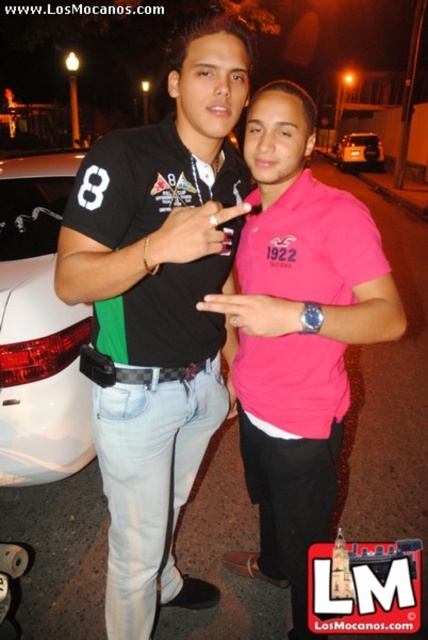
Question: Which object appears closest to the camera in this image?

Choices:
 (A) white glossy car at left
 (B) metallic silver car at center

Answer: (A)

Question: Which of the following is the closest to the observer?

Choices:
 (A) (366, 168)
 (B) (2, 483)

Answer: (B)

Question: Does white glossy car at left appear on the left side of metallic silver car at center?

Choices:
 (A) yes
 (B) no

Answer: (A)

Question: Is white glossy car at left smaller than metallic silver car at center?

Choices:
 (A) yes
 (B) no

Answer: (A)

Question: Observing the image, what is the correct spatial positioning of white glossy car at left in reference to metallic silver car at center?

Choices:
 (A) left
 (B) right

Answer: (A)